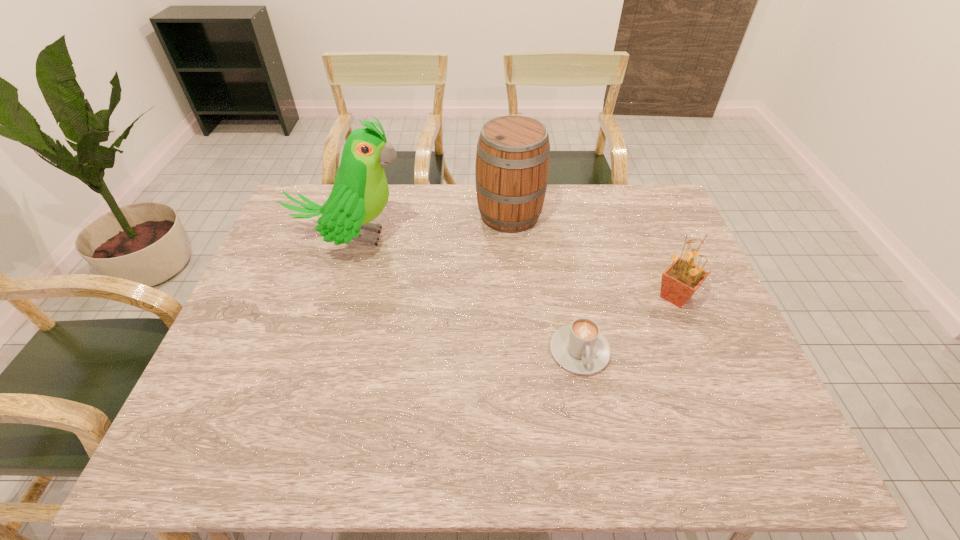
The image size is (960, 540). Find the location of `parakeet`. parakeet is located at coordinates (360, 192).

Identify the location of the leftmost object. (360, 192).

The height and width of the screenshot is (540, 960). I want to click on the third shortest object, so click(x=512, y=164).

Identify the location of the second nearest object. The image size is (960, 540). (682, 278).

You are a GUI agent. You are given a task and a screenshot of the screen. Output one action in this format:
    pyautogui.click(x=<x>, y=<y>)
    Task: Click on the rightmost object
    
    Given the screenshot: What is the action you would take?
    pyautogui.click(x=682, y=278)

Locate an element on the screen. This screenshot has height=540, width=960. the shortest object is located at coordinates pyautogui.click(x=580, y=348).

At what (x,y) coordinates should I click in order to perform the action: click on cappuccino. Please return your answer as a coordinate pair (x, y). Looking at the image, I should click on (580, 348).

This screenshot has width=960, height=540. I want to click on blank area located 0.300m on the beak of the parakeet, so click(506, 238).

At what (x,y) coordinates should I click in order to perform the action: click on vacant space located 0.360m on the right of the cider. Please return your answer as a coordinate pair (x, y). The height and width of the screenshot is (540, 960). Looking at the image, I should click on point(654,215).

Find the location of `free space located at the front of the second shortest object with flowers visible`. free space located at the front of the second shortest object with flowers visible is located at coordinates (593, 296).